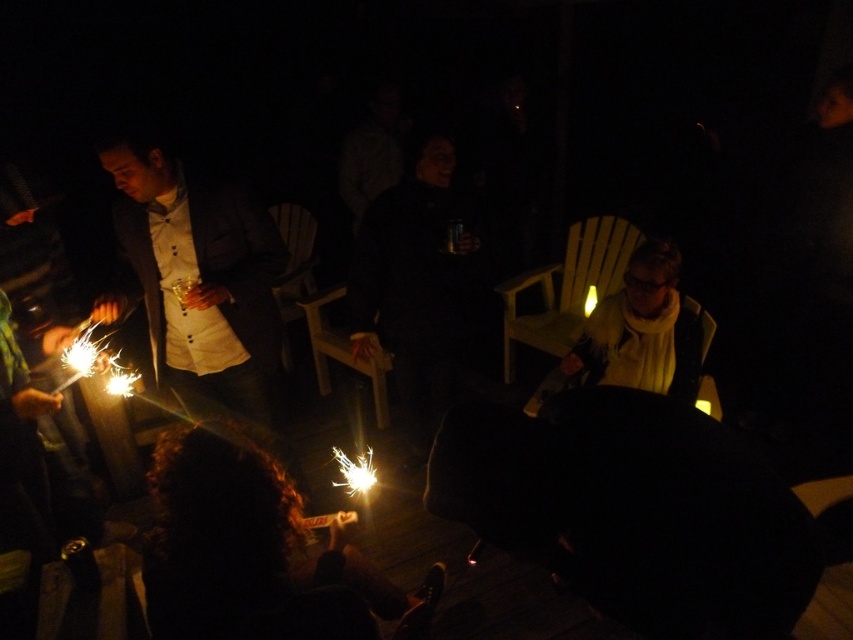
Is matte black suit at left closer to camera compared to yellow plastic chair at center?

Yes, it is.

Is matte black suit at left shorter than yellow plastic chair at center?

In fact, matte black suit at left may be taller than yellow plastic chair at center.

I want to click on matte black suit at left, so click(x=196, y=278).

Is point (224, 353) positioned before point (368, 371)?

Yes, it is.

Who is positioned more to the left, matte black suit at left or wooden chair at center?

Positioned to the left is matte black suit at left.

Is point (132, 241) closer to viewer compared to point (329, 333)?

Yes, it is.

Identify the location of matte black suit at left. (196, 278).

Does wooden chair at center come in front of yellow plastic chair at center?

Yes, it is.

The image size is (853, 640). Describe the element at coordinates (341, 352) in the screenshot. I see `wooden chair at center` at that location.

Locate an element on the screen. wooden chair at center is located at coordinates (341, 352).